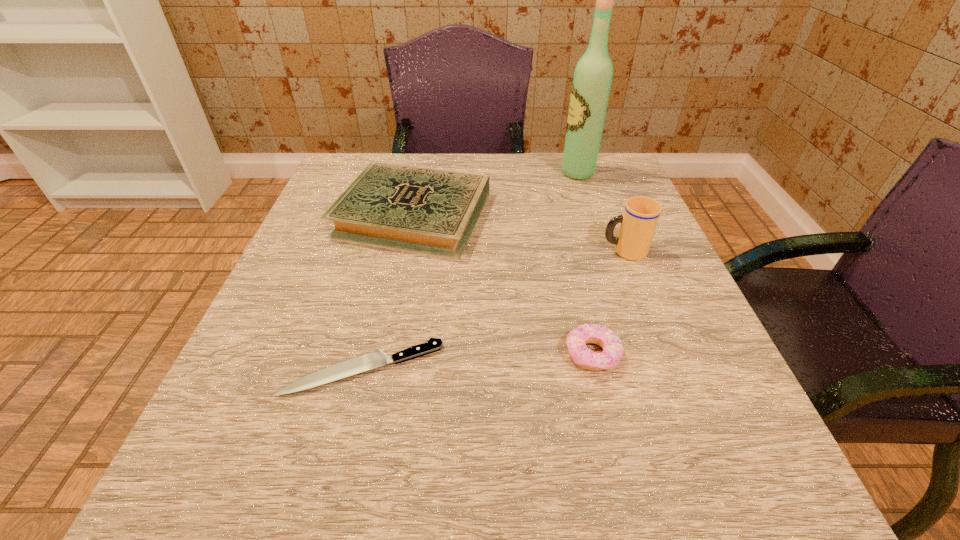
Identify the location of doughnut situated at the right edge. This screenshot has height=540, width=960. (576, 340).

At what (x,y) coordinates should I click in order to perform the action: click on object that is at the far left corner. Please return your answer as a coordinate pair (x, y). The width and height of the screenshot is (960, 540). Looking at the image, I should click on (430, 211).

The image size is (960, 540). What are the coordinates of `object at the far right corner` in the screenshot? It's located at (591, 85).

In order to click on free space at the far edge in this screenshot , I will do `click(556, 174)`.

The height and width of the screenshot is (540, 960). In the image, there is a desktop. Identify the location of free space at the near edge. (544, 498).

The image size is (960, 540). What are the coordinates of `vacant space at the left edge` in the screenshot? It's located at (294, 267).

Identify the location of vacant space at the right edge of the desktop. (658, 397).

Where is `blank area at the far left corner`? blank area at the far left corner is located at coordinates (330, 185).

The height and width of the screenshot is (540, 960). Identify the location of vacant space at the far right corner. (571, 192).

What are the coordinates of `empty location between the wine bottle and the shortest object` in the screenshot? It's located at pos(470,271).